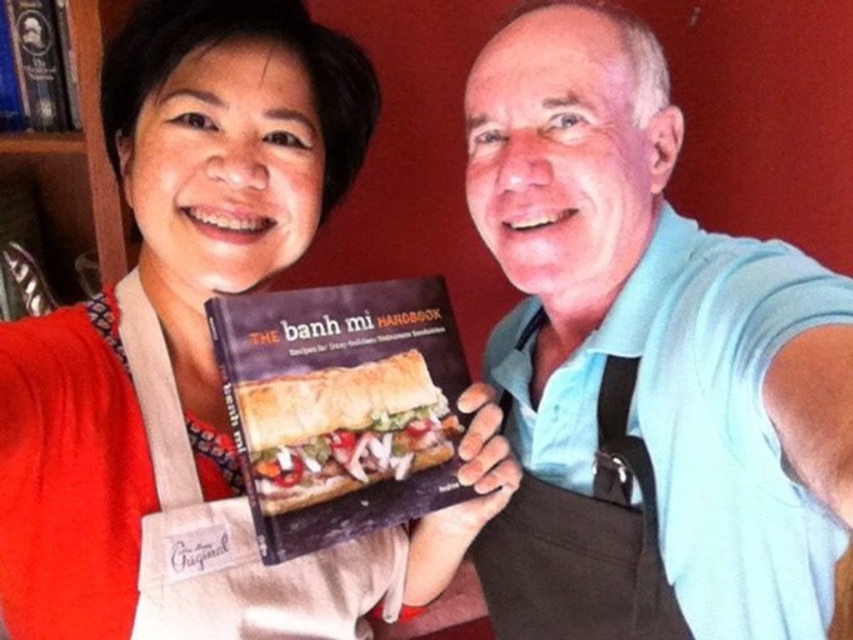
You are a chef trying to place the matte black book at center and the brown fabric apron at center on a shelf that can only hold items up to 12 inches wide. Based on the image, can you determine if both items will fit side by side?

The matte black book at center might be wider than brown fabric apron at center, so it is uncertain if both will fit side by side on the shelf. Measure their widths to confirm.

You are a chef trying to place the matte black book at center and the brown fabric apron at center on a shelf. If the shelf has a height limit of 10 inches, can both items fit vertically without exceeding the height limit?

The matte black book at center is not as tall as the brown fabric apron at center. However, since the exact heights are not provided, we cannot determine if both items will fit within the 10 inch height limit. Additional measurements are needed.

You are a chef in a busy kitchen and need to grab the golden brown bread at center quickly. Is the blue cotton shirt at center blocking your path to it?

The blue cotton shirt at center is in front of the golden brown bread at center, so it is blocking the path to the bread.